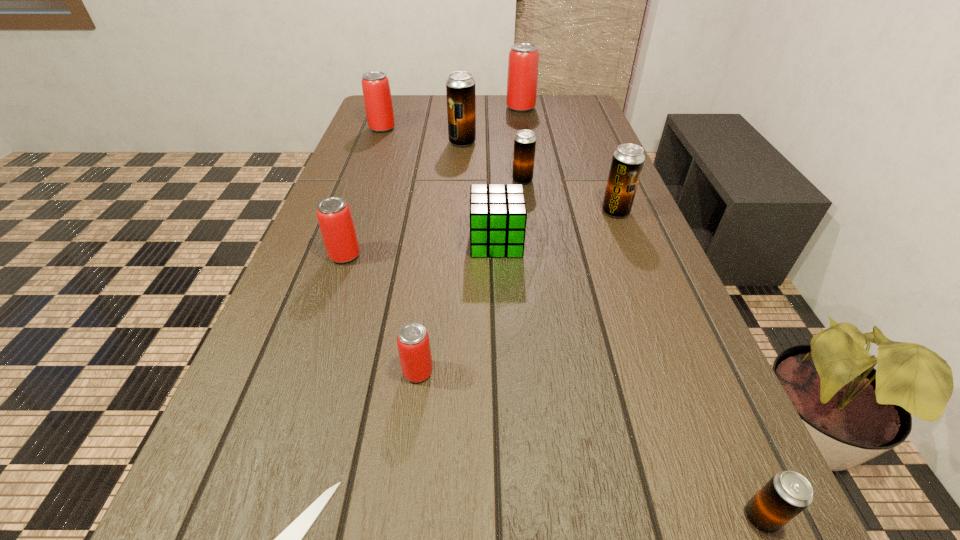
This screenshot has width=960, height=540. I want to click on the farthest object, so click(x=522, y=79).

In order to click on the farthest beer can in this screenshot , I will do `click(522, 79)`.

Image resolution: width=960 pixels, height=540 pixels. What are the coordinates of `the farthest black beer can` in the screenshot? It's located at (460, 86).

Where is `the third farthest object`? Image resolution: width=960 pixels, height=540 pixels. the third farthest object is located at coordinates (460, 86).

You are a GUI agent. You are given a task and a screenshot of the screen. Output one action in this format:
    pyautogui.click(x=<x>, y=<y>)
    Task: Click on the seventh nearest beer can
    Image resolution: width=960 pixels, height=540 pixels.
    Given the screenshot: What is the action you would take?
    (375, 85)

At what (x,y) coordinates should I click in order to perform the action: click on the second farthest object. Please return your answer as a coordinate pair (x, y). This screenshot has height=540, width=960. Looking at the image, I should click on (375, 85).

At what (x,y) coordinates should I click in order to perform the action: click on the second biggest black beer can. Please return your answer as a coordinate pair (x, y). Looking at the image, I should click on (627, 162).

I want to click on the third farthest black beer can, so click(627, 162).

Where is `the second nearest pink beer can`? Image resolution: width=960 pixels, height=540 pixels. the second nearest pink beer can is located at coordinates (334, 216).

Where is `the third biggest pink beer can`? the third biggest pink beer can is located at coordinates (334, 216).